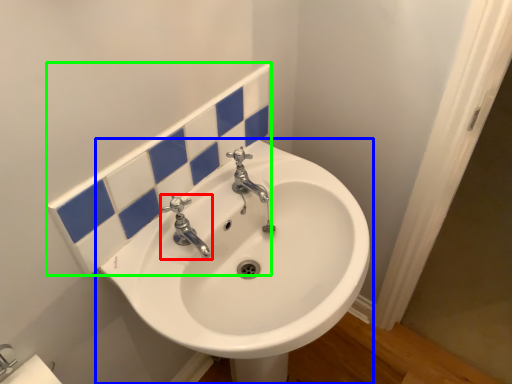
Question: Which object is the farthest from tap (highlighted by a red box)? Choose among these: sink (highlighted by a blue box) or tile (highlighted by a green box).

Choices:
 (A) sink
 (B) tile

Answer: (A)